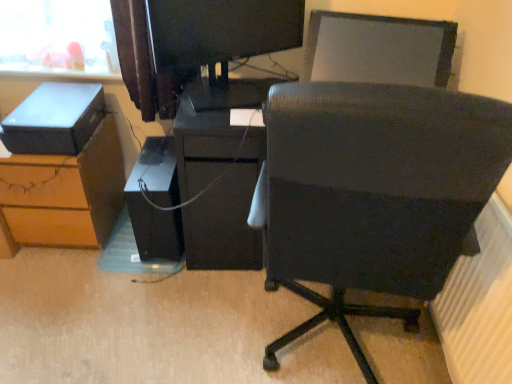
Identify the location of vacant region below black fabric chair at center (from a real-world perspective). The height and width of the screenshot is (384, 512). (333, 339).